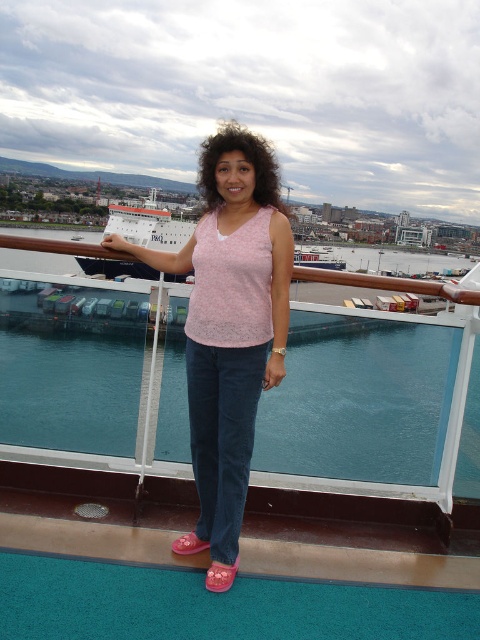
Can you confirm if blue water at center is shorter than white glossy cruise ship at upper left?

Correct, blue water at center is not as tall as white glossy cruise ship at upper left.

Is blue water at center thinner than white glossy cruise ship at upper left?

Indeed, blue water at center has a lesser width compared to white glossy cruise ship at upper left.

Who is more distant from viewer, (425,472) or (126,212)?

Positioned behind is point (126,212).

I want to click on blue water at center, so point(374,404).

Is pink fabric tank top at center further to the viewer compared to white glossy cruise ship at upper left?

No, pink fabric tank top at center is closer to the viewer.

Which is in front, point (210, 301) or point (95, 264)?

Point (210, 301) is in front.

The width and height of the screenshot is (480, 640). In order to click on pink fabric tank top at center in this screenshot , I will do `click(228, 330)`.

Measure the distance from blue water at center to pink fabric tank top at center.

A distance of 1.26 meters exists between blue water at center and pink fabric tank top at center.

Find the location of `blue water at center`. blue water at center is located at coordinates (374, 404).

What do you see at coordinates (374, 404) in the screenshot?
I see `blue water at center` at bounding box center [374, 404].

At what (x,y) coordinates should I click in order to perform the action: click on blue water at center. Please return your answer as a coordinate pair (x, y). Looking at the image, I should click on (374, 404).